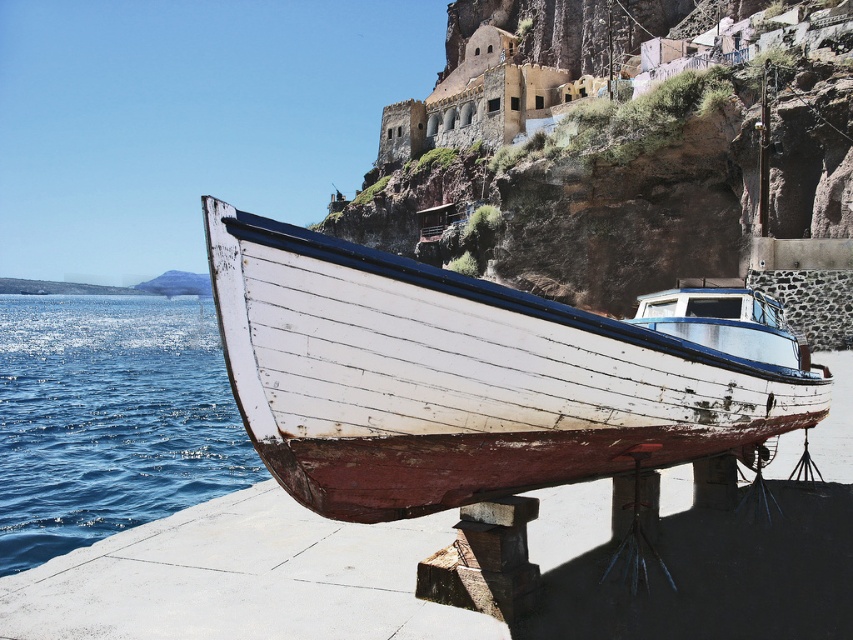
Question: Does white wooden boat at center appear on the right side of blue water at lower left?

Choices:
 (A) no
 (B) yes

Answer: (B)

Question: Is white wooden boat at center to the left of white wood water at lower left from the viewer's perspective?

Choices:
 (A) yes
 (B) no

Answer: (B)

Question: Which point is farther to the camera?

Choices:
 (A) blue water at lower left
 (B) white wood water at lower left

Answer: (A)

Question: Can you confirm if white wooden boat at center is positioned to the left of white wood water at lower left?

Choices:
 (A) yes
 (B) no

Answer: (B)

Question: Which of these objects is positioned farthest from the white wooden boat at center?

Choices:
 (A) white wood water at lower left
 (B) blue water at lower left

Answer: (B)

Question: Which object is closer to the camera taking this photo?

Choices:
 (A) blue water at lower left
 (B) white wood water at lower left
 (C) white wooden boat at center

Answer: (C)